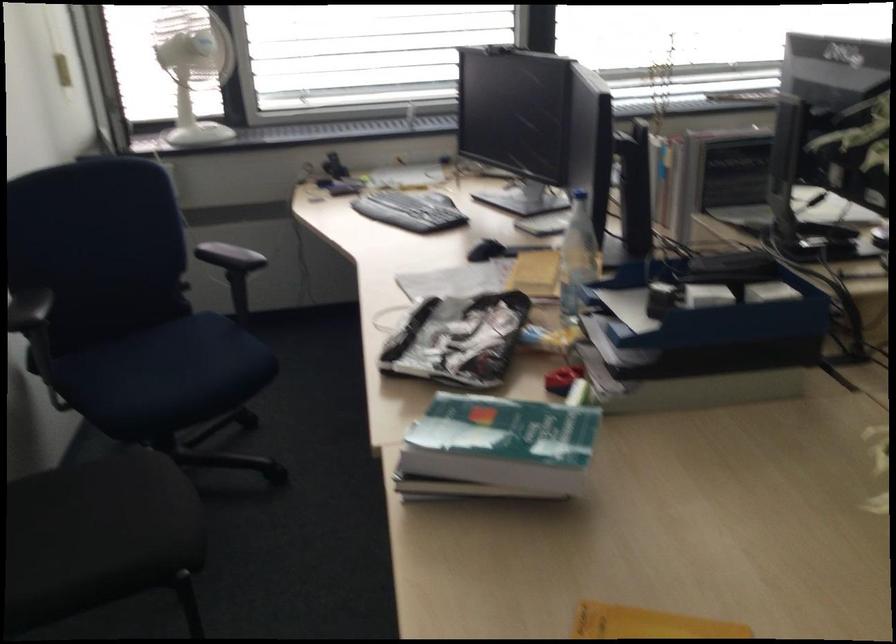
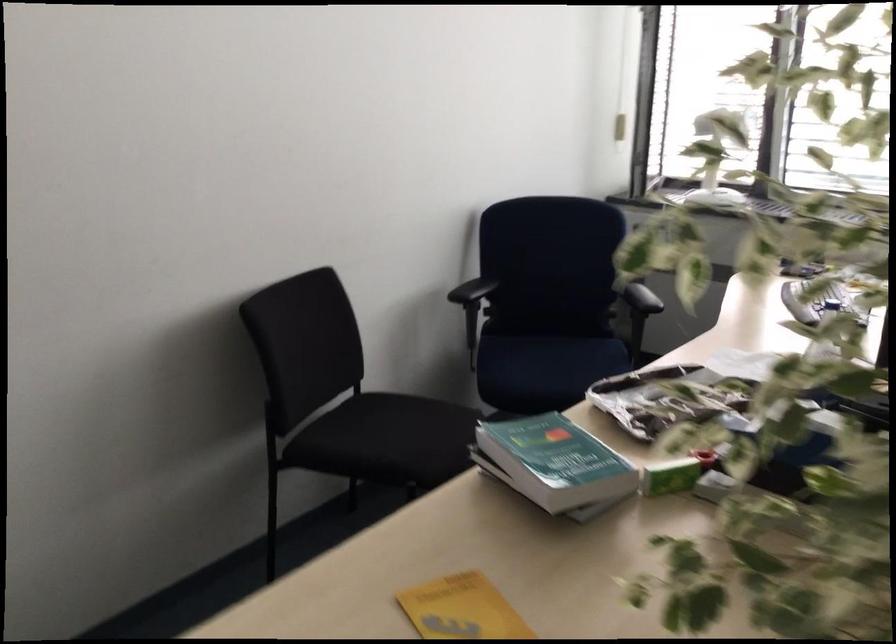
Question: The camera is either moving clockwise (left) or counter-clockwise (right) around the object. The first image is from the beginning of the video and the second image is from the end. Is the camera moving left or right when shooting the video?

Choices:
 (A) Left
 (B) Right

Answer: (B)